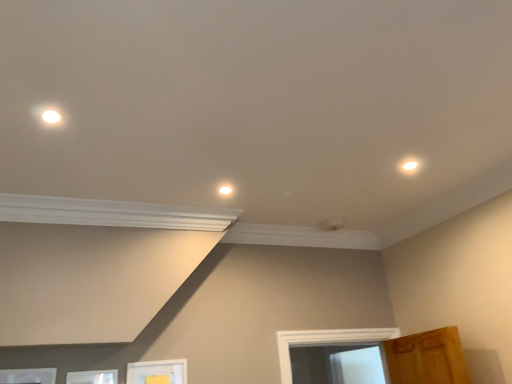
Question: Is white matte picture frame at lower left, acting as the second picture frame starting from the left, at the right side of white matte picture frame at lower center, which appears as the 3th picture frame when viewed from the left?

Choices:
 (A) yes
 (B) no

Answer: (B)

Question: Is the depth of white matte picture frame at lower left, arranged as the 2th picture frame when viewed from the right, less than that of white matte picture frame at lower center, the first picture frame viewed from the right?

Choices:
 (A) yes
 (B) no

Answer: (A)

Question: Can you confirm if white matte picture frame at lower left, acting as the second picture frame starting from the left, is shorter than white matte picture frame at lower center, the first picture frame viewed from the right?

Choices:
 (A) yes
 (B) no

Answer: (A)

Question: From a real-world perspective, does white matte picture frame at lower left, acting as the second picture frame starting from the left, stand above white matte picture frame at lower center, the first picture frame viewed from the right?

Choices:
 (A) no
 (B) yes

Answer: (A)

Question: Is white matte picture frame at lower left, acting as the second picture frame starting from the left, to the left of white matte picture frame at lower center, which appears as the 3th picture frame when viewed from the left, from the viewer's perspective?

Choices:
 (A) yes
 (B) no

Answer: (A)

Question: From the image's perspective, does white matte picture frame at lower left, arranged as the 2th picture frame when viewed from the right, appear lower than white matte picture frame at lower center, which appears as the 3th picture frame when viewed from the left?

Choices:
 (A) yes
 (B) no

Answer: (B)

Question: Is white matte picture frame at lower center, which appears as the 3th picture frame when viewed from the left, far from white matte picture frame at lower left, the 1th picture frame when ordered from left to right?

Choices:
 (A) yes
 (B) no

Answer: (B)

Question: Is white matte picture frame at lower center, which appears as the 3th picture frame when viewed from the left, surrounding white matte picture frame at lower left, acting as the 3th picture frame starting from the right?

Choices:
 (A) yes
 (B) no

Answer: (B)

Question: Is white matte picture frame at lower center, the first picture frame viewed from the right, bigger than white matte picture frame at lower left, acting as the 3th picture frame starting from the right?

Choices:
 (A) no
 (B) yes

Answer: (B)

Question: Is white matte picture frame at lower center, which appears as the 3th picture frame when viewed from the left, shorter than white matte picture frame at lower left, acting as the 3th picture frame starting from the right?

Choices:
 (A) yes
 (B) no

Answer: (B)

Question: From the image's perspective, is white matte picture frame at lower center, the first picture frame viewed from the right, beneath white matte picture frame at lower left, acting as the 3th picture frame starting from the right?

Choices:
 (A) no
 (B) yes

Answer: (B)

Question: Is the depth of white matte picture frame at lower center, the first picture frame viewed from the right, less than that of white matte picture frame at lower left, the 1th picture frame when ordered from left to right?

Choices:
 (A) no
 (B) yes

Answer: (A)

Question: From the image's perspective, is white glossy light fixture at center, the 1th dot when ordered from bottom to top, on top of white glossy light fixture at upper right, which ranks as the second dot in back-to-front order?

Choices:
 (A) yes
 (B) no

Answer: (B)